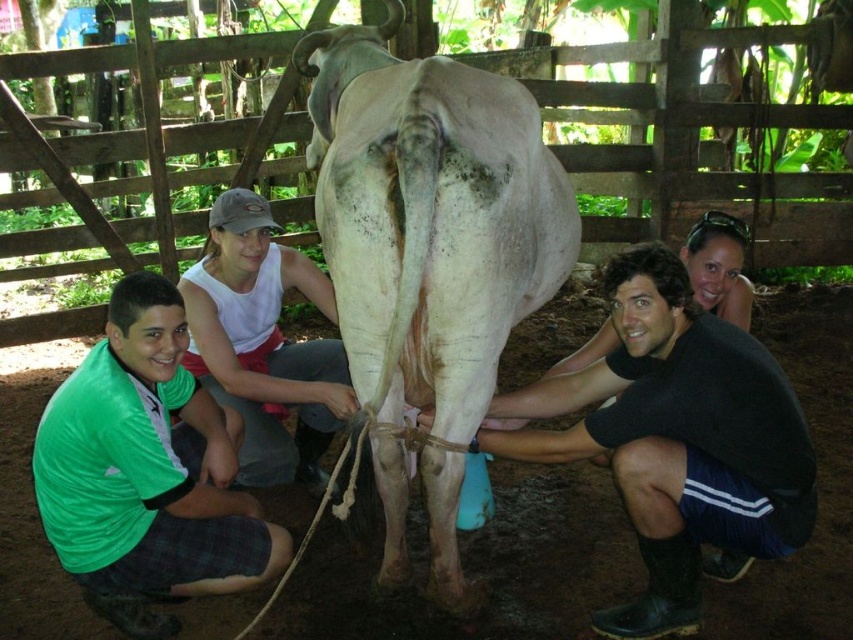
You are a photographer trying to capture a photo of the black rubber boots at lower right and the green fabric shirt at center. Which object should you focus on first if you want to ensure both are in focus without adjusting the camera settings?

The black rubber boots at lower right is shorter than the green fabric shirt at center, so focusing on the green fabric shirt at center first would ensure both are in focus since it is closer to the camera.

You are a photographer trying to capture a photo of the two people wearing green fabric shirts. The camera you are using has a focus range of 1.5 meters. Can you focus on both the green fabric shirt at lower left and the green fabric shirt at center at the same time?

The green fabric shirt at lower left is shorter than the green fabric shirt at center. Since the camera has a focus range of 1.5 meters, if the distance between them is within this range, they can be in focus. However, the exact distance isn not provided, so it depends on their actual separation.